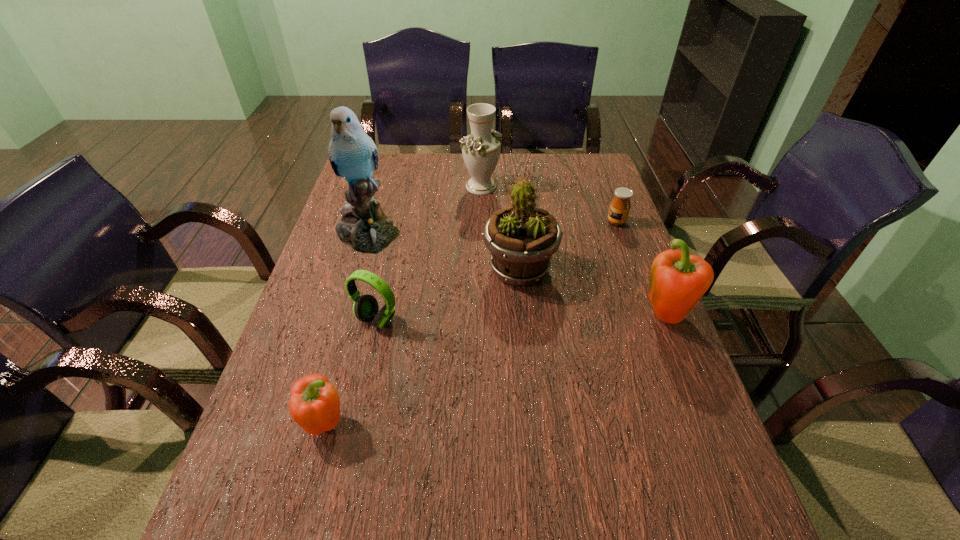
This screenshot has height=540, width=960. In order to click on pepper located in the left edge section of the desktop in this screenshot , I will do `click(315, 404)`.

This screenshot has height=540, width=960. I want to click on parakeet that is at the left edge, so click(x=364, y=227).

Identify the location of headset present at the left edge. The width and height of the screenshot is (960, 540). (365, 308).

The width and height of the screenshot is (960, 540). In order to click on pepper at the right edge in this screenshot , I will do `click(678, 280)`.

Locate an element on the screen. The image size is (960, 540). honey located in the right edge section of the desktop is located at coordinates (620, 206).

The width and height of the screenshot is (960, 540). Find the location of `object present at the near left corner`. object present at the near left corner is located at coordinates (315, 404).

The width and height of the screenshot is (960, 540). In the image, there is a desktop. In order to click on blank space at the far edge in this screenshot , I will do `click(553, 157)`.

This screenshot has width=960, height=540. Find the location of `vacant space at the near edge of the desktop`. vacant space at the near edge of the desktop is located at coordinates (482, 451).

Identify the location of vacant point at the left edge. (273, 375).

This screenshot has height=540, width=960. Find the location of `vacant space at the right edge`. vacant space at the right edge is located at coordinates (623, 408).